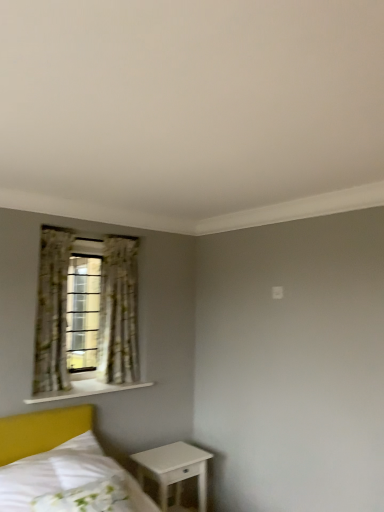
The width and height of the screenshot is (384, 512). What do you see at coordinates (84, 390) in the screenshot?
I see `white wooden shelf at lower left` at bounding box center [84, 390].

In order to click on floral fabric curtain at left in this screenshot , I will do `click(86, 318)`.

Identify the location of floral fabric curtain at left, which is counted as the 2th curtain, starting from the left. Image resolution: width=384 pixels, height=512 pixels. (118, 312).

What's the angular difference between white floral fabric pillow at lower left and white wooden shelf at lower left's facing directions?

5.71 degrees separate the facing orientations of white floral fabric pillow at lower left and white wooden shelf at lower left.

Is white floral fabric pillow at lower left touching white wooden shelf at lower left?

No, white floral fabric pillow at lower left is not next to white wooden shelf at lower left.

At what (x,y) coordinates should I click in order to perform the action: click on pillow that is in front of the white wooden shelf at lower left. Please return your answer as a coordinate pair (x, y). The image size is (384, 512). Looking at the image, I should click on (84, 497).

Is floral fabric curtain at left, marked as the 1th curtain in a left-to-right arrangement, far away from white floral fabric pillow at lower left?

Yes.

Which object is positioned more to the right, floral fabric curtain at left, the second curtain viewed from the right, or white floral fabric pillow at lower left?

Positioned to the right is white floral fabric pillow at lower left.

Which object is closer to the camera taking this photo, floral fabric curtain at left, the second curtain viewed from the right, or white floral fabric pillow at lower left?

white floral fabric pillow at lower left.

Who is bigger, floral fabric curtain at left, marked as the 1th curtain in a left-to-right arrangement, or white floral fabric pillow at lower left?

Bigger between the two is floral fabric curtain at left, marked as the 1th curtain in a left-to-right arrangement.

Is floral fabric curtain at left, the second curtain viewed from the right, bigger or smaller than floral fabric curtain at left, which is counted as the 2th curtain, starting from the left?

In the image, floral fabric curtain at left, the second curtain viewed from the right, appears to be smaller than floral fabric curtain at left, which is counted as the 2th curtain, starting from the left.

Is floral fabric curtain at left, marked as the 1th curtain in a left-to-right arrangement, inside the boundaries of floral fabric curtain at left, the first curtain viewed from the right, or outside?

floral fabric curtain at left, marked as the 1th curtain in a left-to-right arrangement, is outside floral fabric curtain at left, the first curtain viewed from the right.

Which object is closer to the camera taking this photo, floral fabric curtain at left, marked as the 1th curtain in a left-to-right arrangement, or floral fabric curtain at left, the first curtain viewed from the right?

floral fabric curtain at left, marked as the 1th curtain in a left-to-right arrangement.

Is white glossy nightstand at lower right facing away from floral fabric curtain at left, which is counted as the 2th curtain, starting from the left?

white glossy nightstand at lower right is not turned away from floral fabric curtain at left, which is counted as the 2th curtain, starting from the left.

Which of these two, white glossy nightstand at lower right or floral fabric curtain at left, the first curtain viewed from the right, is smaller?

floral fabric curtain at left, the first curtain viewed from the right.

Image resolution: width=384 pixels, height=512 pixels. What are the coordinates of `curtain that is the 2nd object located behind the white glossy nightstand at lower right` in the screenshot? It's located at (118, 312).

Which point is more forward, (x=153, y=456) or (x=107, y=284)?

The point (x=153, y=456) is more forward.

From the image's perspective, does floral fabric curtain at left appear higher than floral fabric curtain at left, the second curtain viewed from the right?

No.

Is point (111, 360) closer or farther from the camera than point (50, 342)?

Point (111, 360) is positioned farther from the camera compared to point (50, 342).

Is floral fabric curtain at left, the second curtain viewed from the right, located within floral fabric curtain at left?

Yes, floral fabric curtain at left, the second curtain viewed from the right, is a part of floral fabric curtain at left.

From a real-world perspective, which is physically above, floral fabric curtain at left or floral fabric curtain at left, the second curtain viewed from the right?

floral fabric curtain at left.

Between white glossy nightstand at lower right and floral fabric curtain at left, which one has larger width?

white glossy nightstand at lower right.

Find the location of a particular element. window located on the left of white glossy nightstand at lower right is located at coordinates (86, 318).

Which is more to the left, white glossy nightstand at lower right or floral fabric curtain at left?

floral fabric curtain at left.

How different are the orientations of white glossy nightstand at lower right and floral fabric curtain at left in degrees?

The facing directions of white glossy nightstand at lower right and floral fabric curtain at left are 0.758 degrees apart.

Could you measure the distance between floral fabric curtain at left and floral fabric curtain at left, the first curtain viewed from the right?

floral fabric curtain at left and floral fabric curtain at left, the first curtain viewed from the right, are 6.82 inches apart from each other.

Which of these two, floral fabric curtain at left or floral fabric curtain at left, which is counted as the 2th curtain, starting from the left, stands taller?

floral fabric curtain at left is taller.

Is floral fabric curtain at left thinner than floral fabric curtain at left, which is counted as the 2th curtain, starting from the left?

No.

Does floral fabric curtain at left turn towards floral fabric curtain at left, the first curtain viewed from the right?

Yes, floral fabric curtain at left is aimed at floral fabric curtain at left, the first curtain viewed from the right.

You are a GUI agent. You are given a task and a screenshot of the screen. Output one action in this format:
    pyautogui.click(x=<x>, y=<y>)
    Task: Click on the pillow in front of the white wooden shelf at lower left
    
    Given the screenshot: What is the action you would take?
    pyautogui.click(x=84, y=497)

Image resolution: width=384 pixels, height=512 pixels. I want to click on curtain that is the 2nd one when counting leftward from the white floral fabric pillow at lower left, so click(52, 311).

Considering their positions, is floral fabric curtain at left, the second curtain viewed from the right, positioned closer to white floral fabric pillow at lower left than white glossy nightstand at lower right?

The object closer to white floral fabric pillow at lower left is white glossy nightstand at lower right.

Which object lies further to the anchor point floral fabric curtain at left, marked as the 1th curtain in a left-to-right arrangement, floral fabric curtain at left or white floral fabric pillow at lower left?

white floral fabric pillow at lower left is positioned further to the anchor floral fabric curtain at left, marked as the 1th curtain in a left-to-right arrangement.

Looking at the image, which one is located further to white glossy nightstand at lower right, floral fabric curtain at left, which is counted as the 2th curtain, starting from the left, or floral fabric curtain at left, the second curtain viewed from the right?

floral fabric curtain at left, the second curtain viewed from the right, lies further to white glossy nightstand at lower right than the other object.

Estimate the real-world distances between objects in this image. Which object is further from floral fabric curtain at left, the second curtain viewed from the right, white glossy nightstand at lower right or floral fabric curtain at left?

The object further to floral fabric curtain at left, the second curtain viewed from the right, is white glossy nightstand at lower right.

Looking at the image, which one is located closer to floral fabric curtain at left, the first curtain viewed from the right, white floral fabric pillow at lower left or white glossy nightstand at lower right?

white glossy nightstand at lower right is positioned closer to the anchor floral fabric curtain at left, the first curtain viewed from the right.

Considering their positions, is floral fabric curtain at left, the second curtain viewed from the right, positioned further to white glossy nightstand at lower right than white wooden shelf at lower left?

Based on the image, floral fabric curtain at left, the second curtain viewed from the right, appears to be further to white glossy nightstand at lower right.

When comparing their distances from white wooden shelf at lower left, does floral fabric curtain at left or floral fabric curtain at left, marked as the 1th curtain in a left-to-right arrangement, seem further?

floral fabric curtain at left is positioned further to the anchor white wooden shelf at lower left.

When comparing their distances from white glossy nightstand at lower right, does floral fabric curtain at left or white floral fabric pillow at lower left seem further?

floral fabric curtain at left is further to white glossy nightstand at lower right.

Locate an element on the screen. This screenshot has width=384, height=512. curtain between floral fabric curtain at left, the second curtain viewed from the right, and white glossy nightstand at lower right, in the vertical direction is located at coordinates tap(118, 312).

Identify the location of window positioned between white floral fabric pillow at lower left and floral fabric curtain at left, marked as the 1th curtain in a left-to-right arrangement, from near to far. The width and height of the screenshot is (384, 512). tap(86, 318).

The height and width of the screenshot is (512, 384). I want to click on curtain between floral fabric curtain at left and white wooden shelf at lower left in the vertical direction, so click(x=118, y=312).

This screenshot has width=384, height=512. Find the location of `curtain between floral fabric curtain at left and white glossy nightstand at lower right from top to bottom`. curtain between floral fabric curtain at left and white glossy nightstand at lower right from top to bottom is located at coordinates (118, 312).